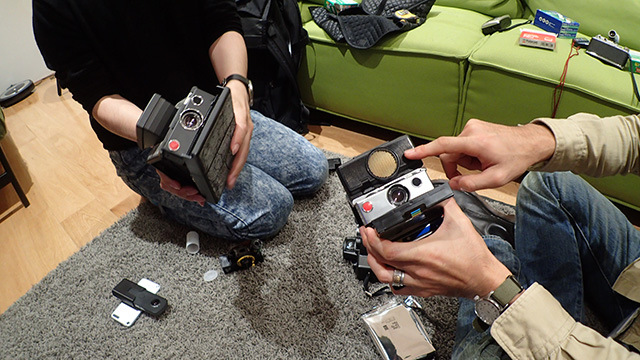
This screenshot has width=640, height=360. Find the location of `wood floor`. wood floor is located at coordinates (48, 249).